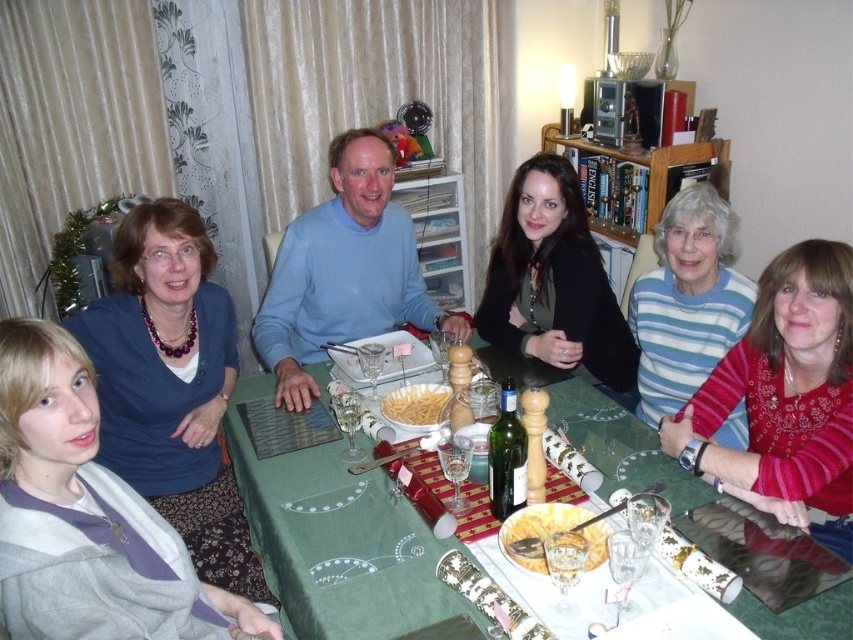
Question: Which object is farther from the camera taking this photo?

Choices:
 (A) light blue sweater at center
 (B) yellowish matte pasta at center
 (C) yellow pasta at center
 (D) matte blue sweater at upper left

Answer: (A)

Question: From the image, what is the correct spatial relationship of striped sweater at center in relation to yellow pasta at center?

Choices:
 (A) left
 (B) right

Answer: (B)

Question: Is red knit sweater at lower right positioned behind black matte jacket at center?

Choices:
 (A) no
 (B) yes

Answer: (A)

Question: Is green fabric table at center below black matte jacket at center?

Choices:
 (A) yes
 (B) no

Answer: (A)

Question: Based on their relative distances, which object is nearer to the yellow pasta at center?

Choices:
 (A) green fabric table at center
 (B) matte blue sweater at upper left
 (C) black matte jacket at center

Answer: (A)

Question: Which of the following is the farthest from the observer?

Choices:
 (A) (422, 404)
 (B) (357, 129)
 (C) (817, 332)

Answer: (B)